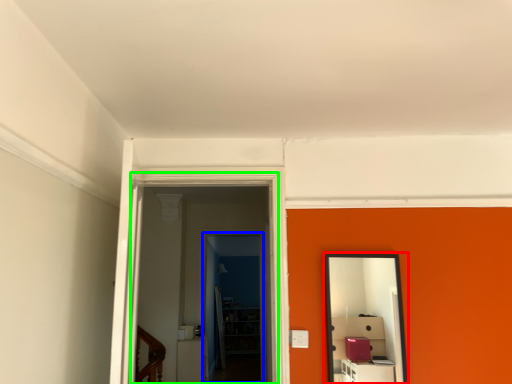
Question: Estimate the real-world distances between objects in this image. Which object is closer to mirror (highlighted by a red box), glass door (highlighted by a blue box) or glass door (highlighted by a green box)?

Choices:
 (A) glass door
 (B) glass door

Answer: (B)